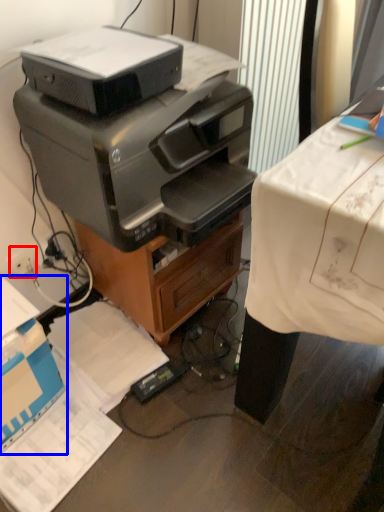
Question: Which of the following is the farthest to the observer, plug (highlighted by a red box) or cardboard box (highlighted by a blue box)?

Choices:
 (A) plug
 (B) cardboard box

Answer: (A)